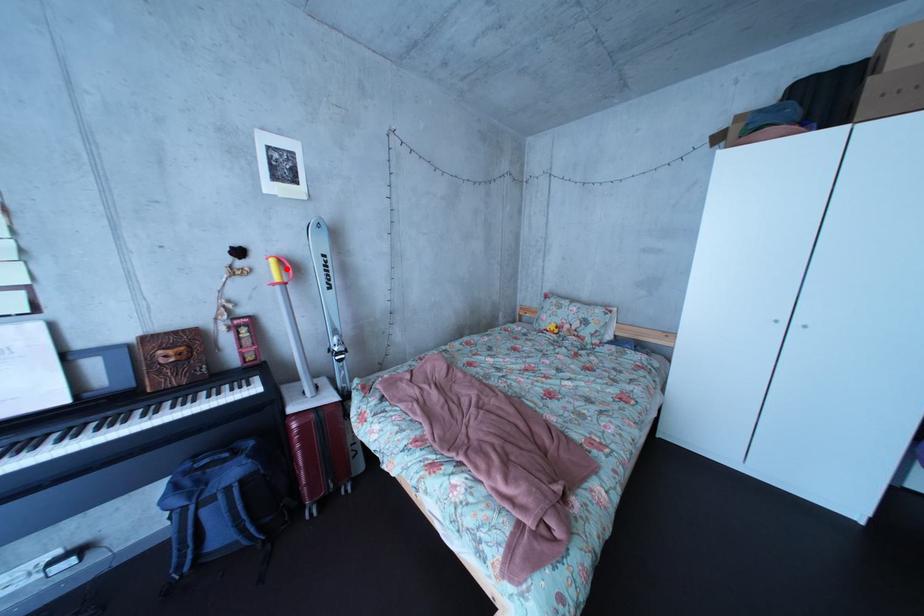
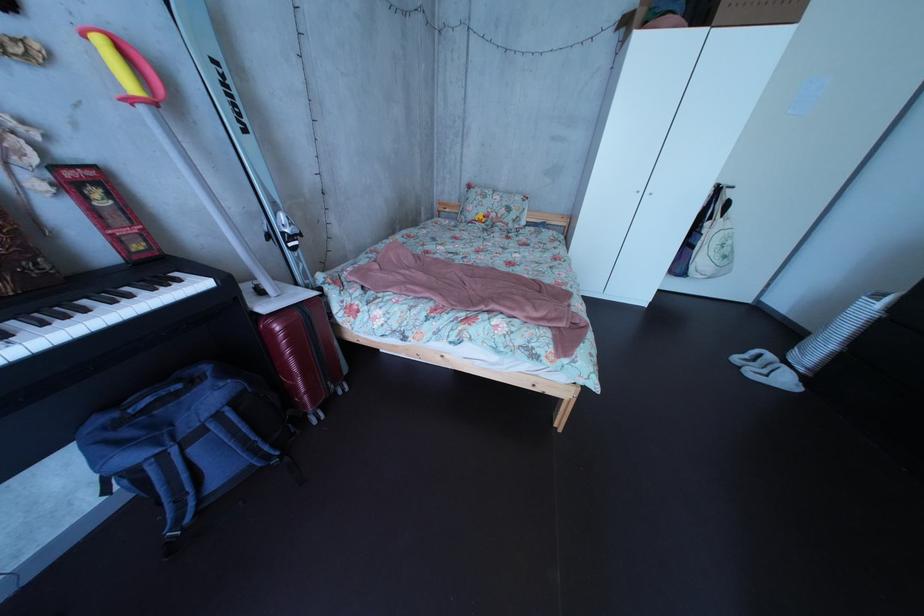
Where in the second image is the point corresponding to the highlighted location from the first image?

(116, 51)